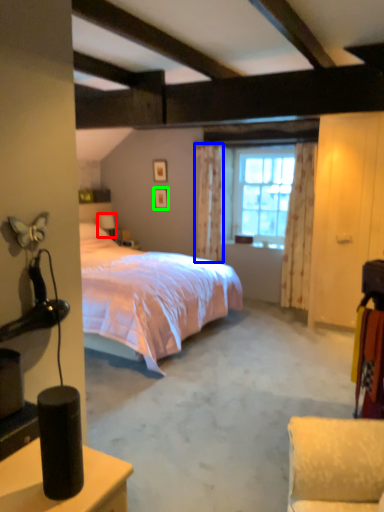
Question: Considering the real-world distances, which object is closest to table lamp (highlighted by a red box)? curtain (highlighted by a blue box) or picture frame (highlighted by a green box).

Choices:
 (A) curtain
 (B) picture frame

Answer: (B)